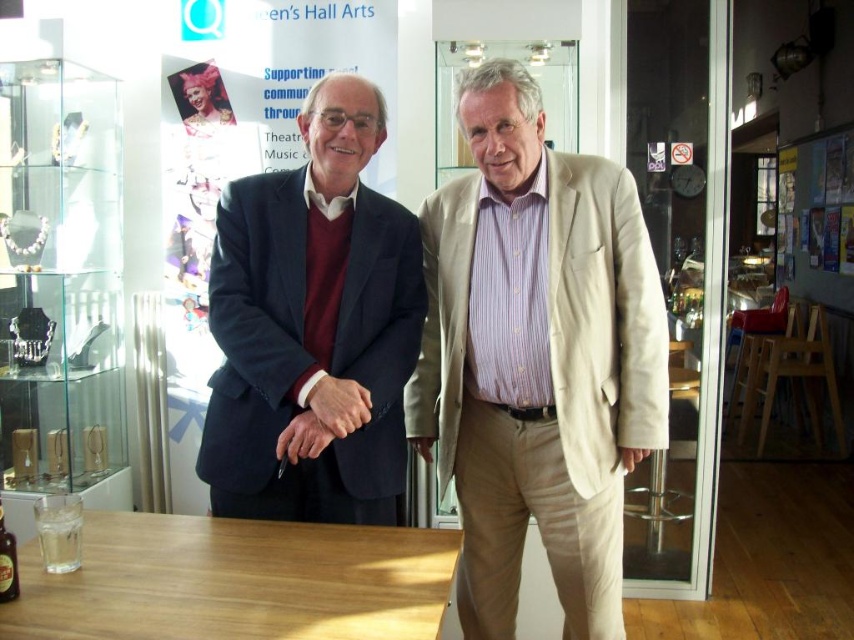
Consider the image. Does matte black suit at center appear on the left side of clear glass bottle at lower left?

In fact, matte black suit at center is to the right of clear glass bottle at lower left.

The width and height of the screenshot is (854, 640). What do you see at coordinates (313, 326) in the screenshot?
I see `matte black suit at center` at bounding box center [313, 326].

Locate an element on the screen. matte black suit at center is located at coordinates (313, 326).

Is light brown wood table at center wider than clear glass bottle at lower left?

Correct, the width of light brown wood table at center exceeds that of clear glass bottle at lower left.

Can you confirm if light brown wood table at center is taller than clear glass bottle at lower left?

In fact, light brown wood table at center may be shorter than clear glass bottle at lower left.

Is point (214, 570) in front of point (3, 556)?

No, (214, 570) is behind (3, 556).

This screenshot has height=640, width=854. What are the coordinates of `light brown wood table at center` in the screenshot? It's located at (235, 580).

Which of these two, beige cotton suit at center or clear glass bottle at lower left, stands shorter?

clear glass bottle at lower left is shorter.

Who is lower down, beige cotton suit at center or clear glass bottle at lower left?

Positioned lower is clear glass bottle at lower left.

Describe the element at coordinates (536, 356) in the screenshot. I see `beige cotton suit at center` at that location.

The width and height of the screenshot is (854, 640). I want to click on beige cotton suit at center, so click(x=536, y=356).